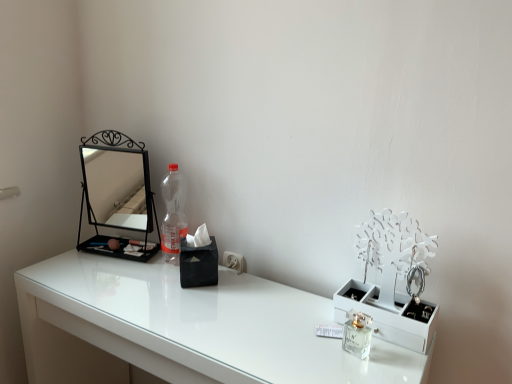
In order to click on free location to the right of clear glass perfume at center in this screenshot , I will do `click(398, 352)`.